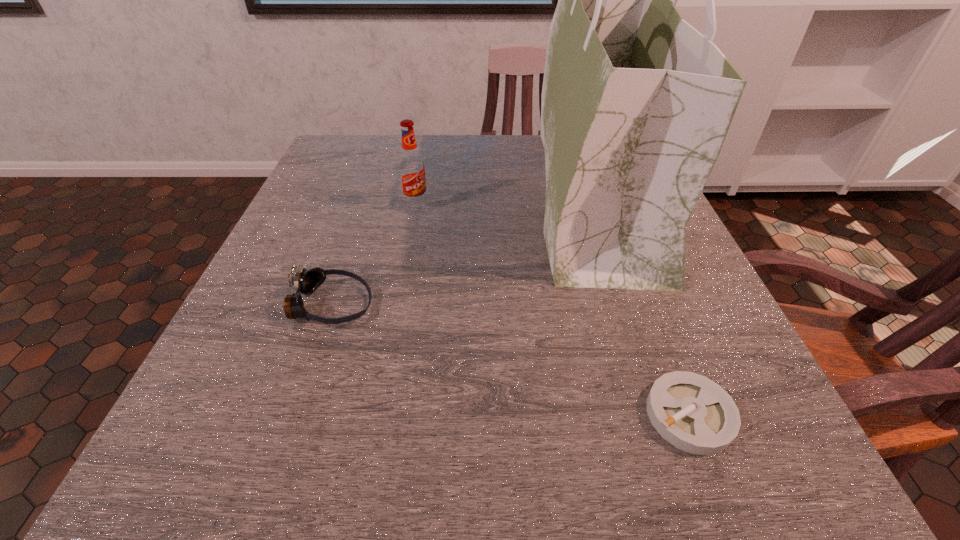
Locate an element on the screen. This screenshot has height=540, width=960. vacant point located between the second tallest object and the ashtray is located at coordinates (553, 310).

Find the location of a particular element. This screenshot has height=540, width=960. free space between the second tallest object and the second shortest object is located at coordinates (373, 255).

I want to click on the closest object to the grocery bag, so click(x=693, y=413).

This screenshot has height=540, width=960. Identify the location of object that stands as the second closest to the leftmost object. (636, 103).

I want to click on free point that satisfies the following two spatial constraints: 1. through the lenses of the leftmost object; 2. on the back side of the shortest object, so click(294, 415).

At what (x,y) coordinates should I click in order to perform the action: click on vacant area in the image that satisfies the following two spatial constraints: 1. on the front side of the third shortest object; 2. through the lenses of the second shortest object. Please return your answer as a coordinate pair (x, y). This screenshot has width=960, height=540. Looking at the image, I should click on (397, 305).

Where is `vacant space that satisfies the following two spatial constraints: 1. on the front side of the second object from left to right; 2. through the lenses of the leftmost object`? The width and height of the screenshot is (960, 540). vacant space that satisfies the following two spatial constraints: 1. on the front side of the second object from left to right; 2. through the lenses of the leftmost object is located at coordinates (397, 305).

Where is `vacant region that satisfies the following two spatial constraints: 1. on the back side of the tallest object; 2. on the left side of the third shortest object`? The height and width of the screenshot is (540, 960). vacant region that satisfies the following two spatial constraints: 1. on the back side of the tallest object; 2. on the left side of the third shortest object is located at coordinates (418, 197).